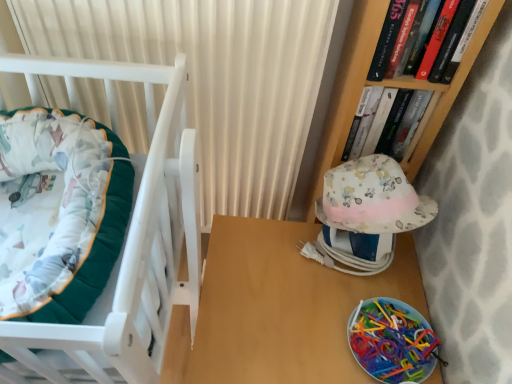
Question: In terms of height, does hardcover book at upper right, which ranks as the second book in back-to-front order, look taller or shorter compared to wooden table at center?

Choices:
 (A) short
 (B) tall

Answer: (A)

Question: Is point (446, 69) positioned closer to the camera than point (369, 276)?

Choices:
 (A) closer
 (B) farther

Answer: (A)

Question: Which object is the closest to the velvet green cushion at left?

Choices:
 (A) fluffy cotton hat at right
 (B) white textured curtain at upper center
 (C) hardcover book at upper right, which appears as the first book when viewed from the front
 (D) wooden table at center
 (E) translucent plastic plate at lower right

Answer: (B)

Question: Based on their relative distances, which object is farther from the translucent plastic plate at lower right?

Choices:
 (A) velvet green cushion at left
 (B) fluffy cotton hat at right
 (C) wooden table at center
 (D) hardcover book at upper right, which appears as the first book when viewed from the front
 (E) hardcover book at upper right, the second book positioned from the front

Answer: (D)